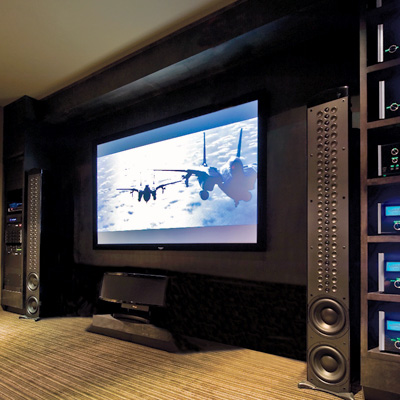
The image size is (400, 400). Find the location of `canopy`. canopy is located at coordinates (235, 161), (146, 185).